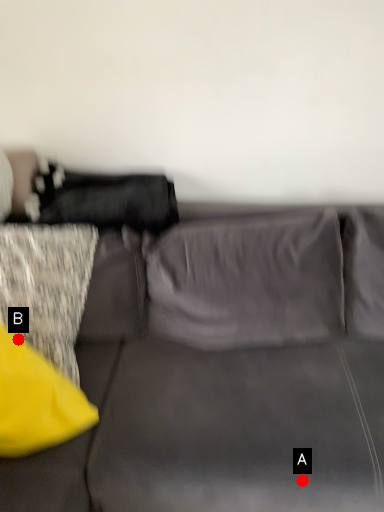
Question: Two points are circled on the image, labeled by A and B beside each circle. Among these points, which one is farthest from the camera?

Choices:
 (A) A is further
 (B) B is further

Answer: (B)